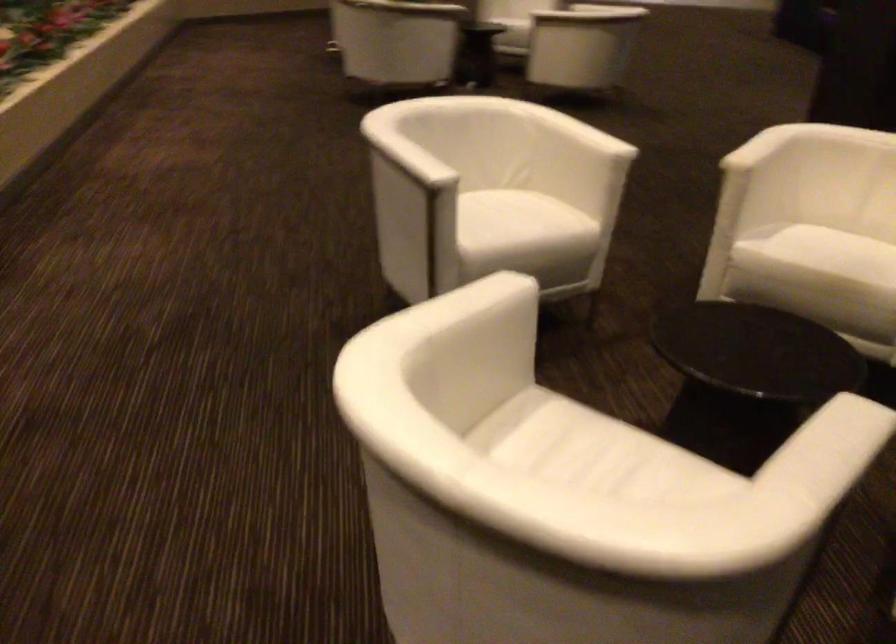
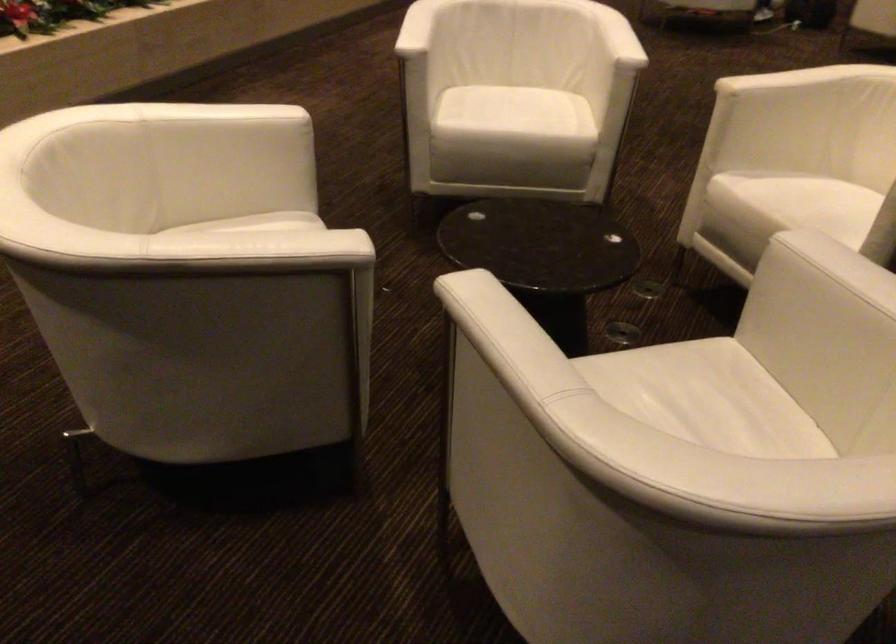
The point at (533,415) is marked in the first image. Where is the corresponding point in the second image?

(265, 223)